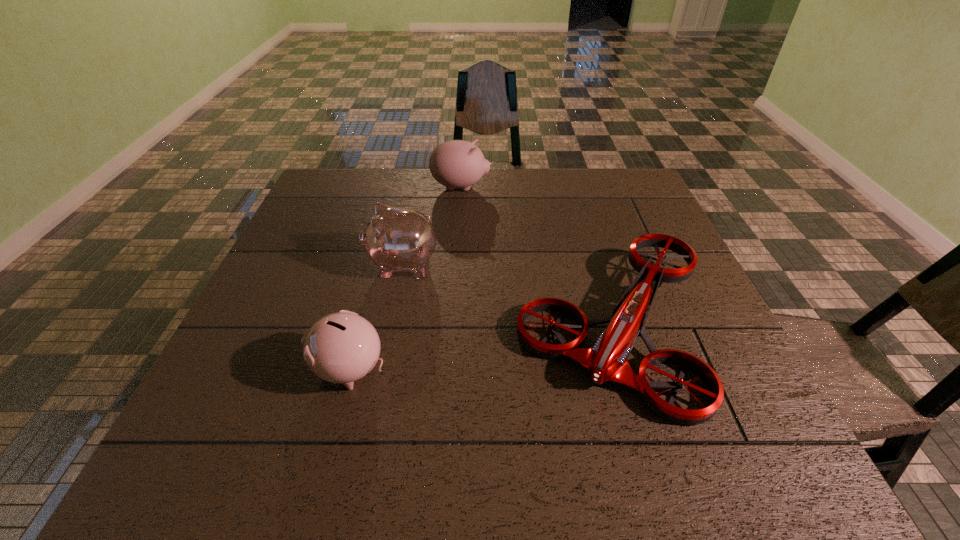
Where is `the second nearest piggy bank`? Image resolution: width=960 pixels, height=540 pixels. the second nearest piggy bank is located at coordinates (396, 239).

Where is `the farthest object`? The width and height of the screenshot is (960, 540). the farthest object is located at coordinates (457, 163).

Locate an element on the screen. The image size is (960, 540). the nearest piggy bank is located at coordinates (343, 347).

Locate an element on the screen. The height and width of the screenshot is (540, 960). the shortest object is located at coordinates (607, 360).

Identify the location of the rightmost object. Image resolution: width=960 pixels, height=540 pixels. (607, 360).

The image size is (960, 540). What are the coordinates of `free spot located 0.110m on the front facing side of the second nearest piggy bank` in the screenshot? It's located at (323, 265).

Identify the location of free space located 0.210m on the front facing side of the second nearest piggy bank. This screenshot has width=960, height=540. (283, 265).

The image size is (960, 540). I want to click on free space located 0.100m on the front facing side of the second nearest piggy bank, so click(326, 265).

Find the location of `vacant area situated 0.400m at the snout of the farthest object`. vacant area situated 0.400m at the snout of the farthest object is located at coordinates (615, 187).

What are the coordinates of `vacant region located 0.340m on the back of the nearest piggy bank` in the screenshot? It's located at (383, 244).